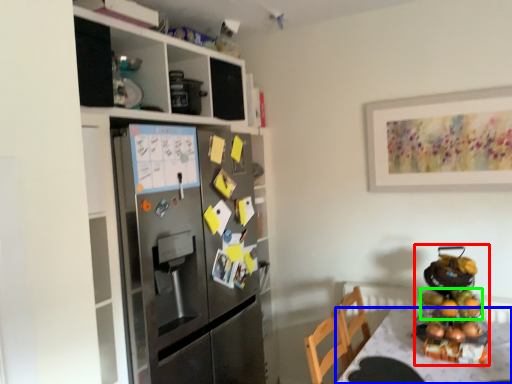
Question: Considering the real-world distances, which object is farthest from appliance (highlighted by a red box)? desk (highlighted by a blue box) or fruit (highlighted by a green box)?

Choices:
 (A) desk
 (B) fruit

Answer: (A)